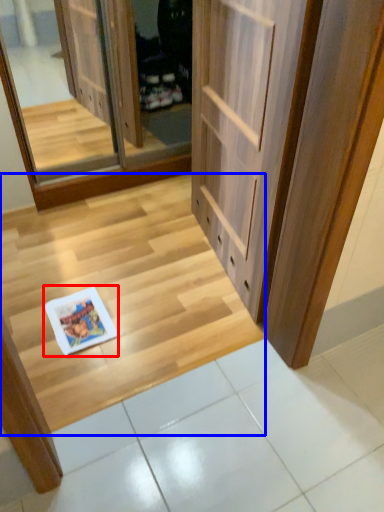
Question: Which object is further to the camera taking this photo, magazine (highlighted by a red box) or stairwell (highlighted by a blue box)?

Choices:
 (A) magazine
 (B) stairwell

Answer: (A)